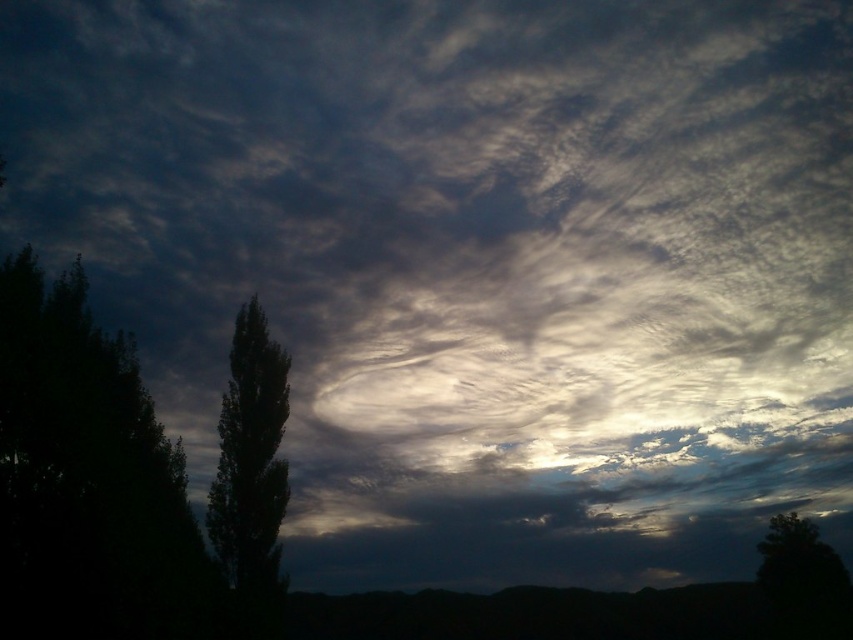
You are an observer looking at the sky scene. You notice two dark green leafy trees in the image. Which tree, the dark green leafy tree at left or the dark green leafy tree at lower right, is closer to you?

The dark green leafy tree at left is closer to you because it is positioned in front of the dark green leafy tree at lower right.